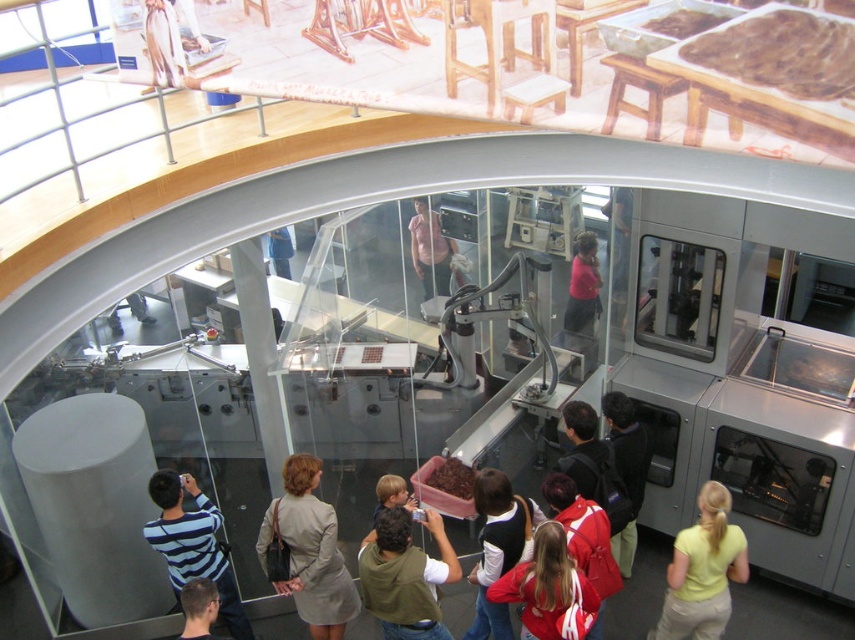
You are standing in the museum and see the striped cotton shirt at lower left and the dark blue backpack at lower right. Which object is closer to the ground?

The striped cotton shirt at lower left is closer to the ground because it is positioned under the dark blue backpack at lower right.

Based on the photo, you are standing at the entrance of the museum and see two points marked on the floor. The first point is at coordinate point (192, 481) and the second point is at coordinate point (641, 484). If you want to walk from the entrance to the point that is closer to the glass barrier where the machine is displayed, which point should you head towards?

You should head towards point (192, 481) because it is in front of point (641, 484), meaning it is closer to the glass barrier where the machine is displayed.

You are a tour guide in the museum and you need to direct a visitor to the red fabric jacket at lower center. Which direction should they move relative to the green fabric hoodie at center?

The red fabric jacket at lower center is to the right of the green fabric hoodie at center. The visitor should move to the right of the green fabric hoodie at center to locate the red fabric jacket at lower center.